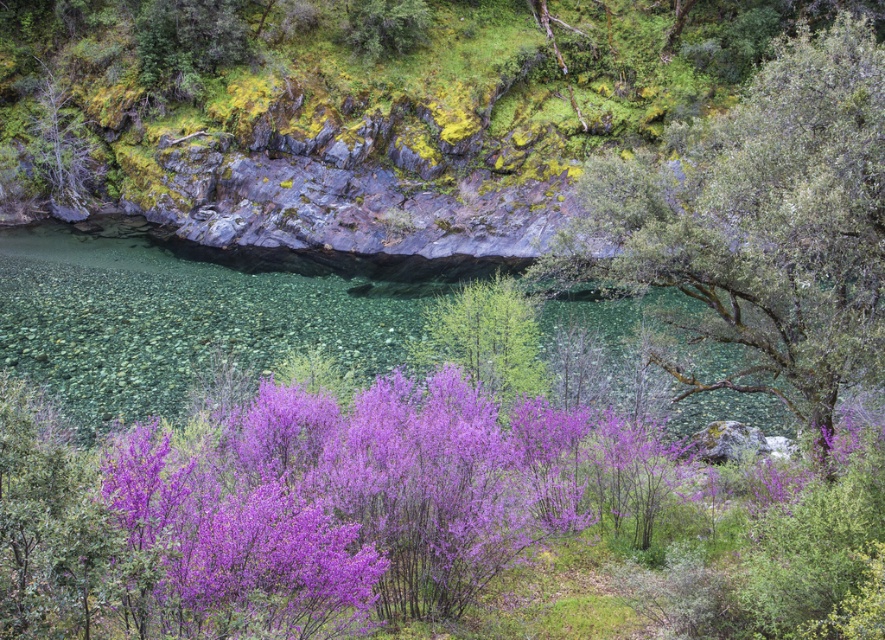
You are a bird flying over the landscape and want to land on the closest object between the purple matte flowers at center and the green leafy tree at upper right. Which object should you choose?

The purple matte flowers at center are closer to the viewer than the green leafy tree at upper right, so you should land on the purple matte flowers at center.

You are standing at the point marked as point (358, 502) in this landscape. What can you see directly in front of you?

At point (358, 502) lies purple matte flowers at center.

You are an artist setting up your easel to paint the scene. You want to capture the purple matte flowers at center and the green leafy tree at upper right in your painting. Which object should you place on the left side of your canvas to maintain the scene as seen?

You should place the purple matte flowers at center on the left side of your canvas since it is to the left of the green leafy tree at upper right in the original scene.